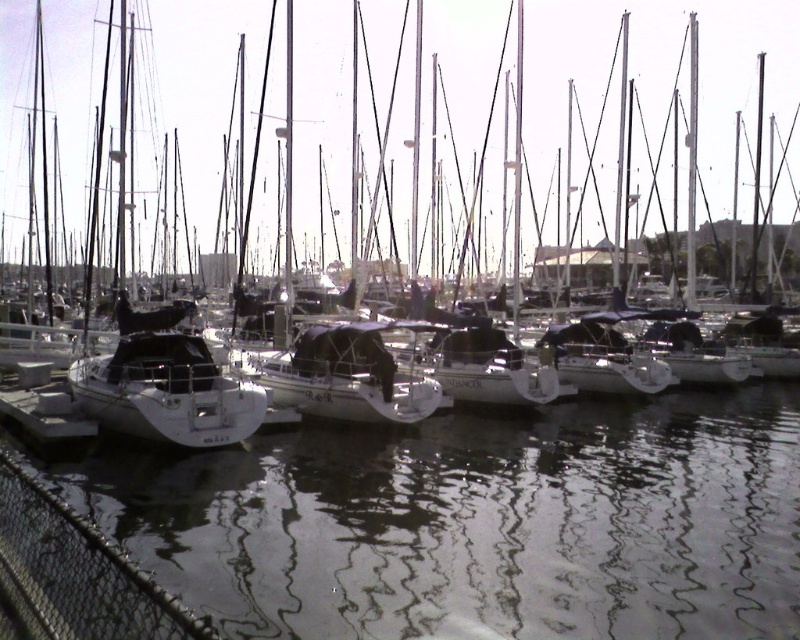
Is clear water at center shorter than white matte sailboat at left?

Indeed, clear water at center has a lesser height compared to white matte sailboat at left.

Is clear water at center smaller than white matte sailboat at left?

Answer: Yes.

Is point (678, 410) closer to viewer compared to point (332, 138)?

Yes.

Find the location of `clear water at center`. clear water at center is located at coordinates (476, 522).